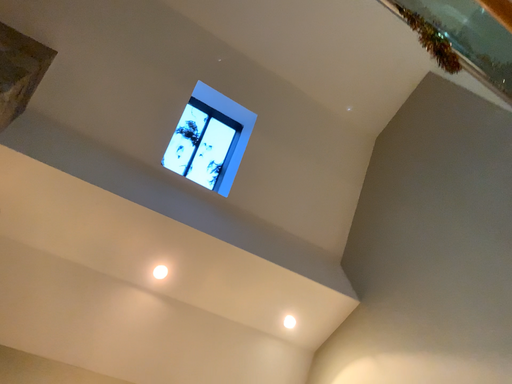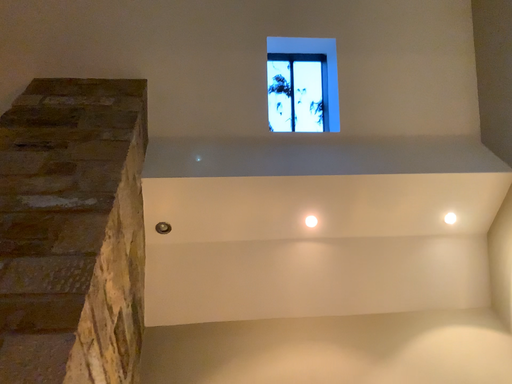
Question: Which way did the camera rotate in the video?

Choices:
 (A) rotated right
 (B) rotated left

Answer: (B)